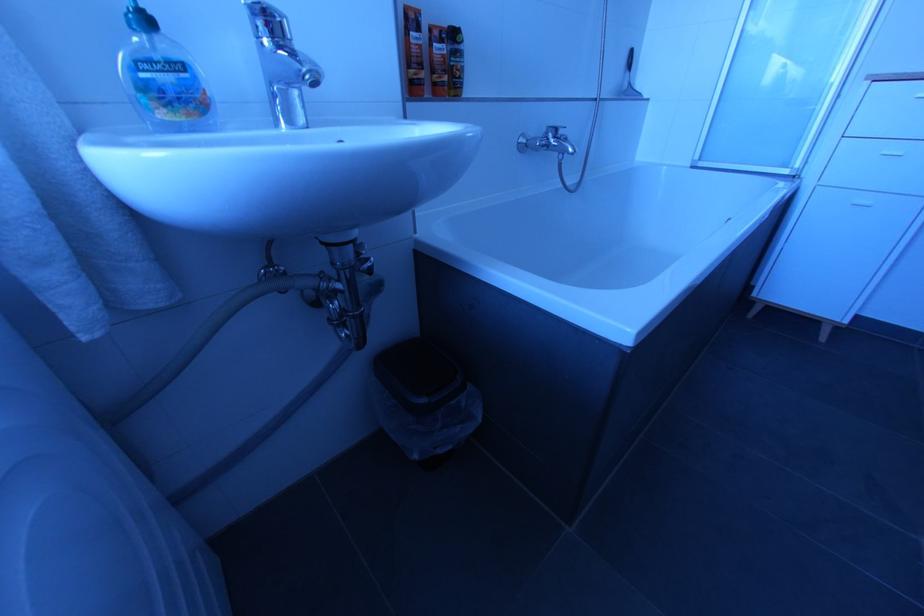
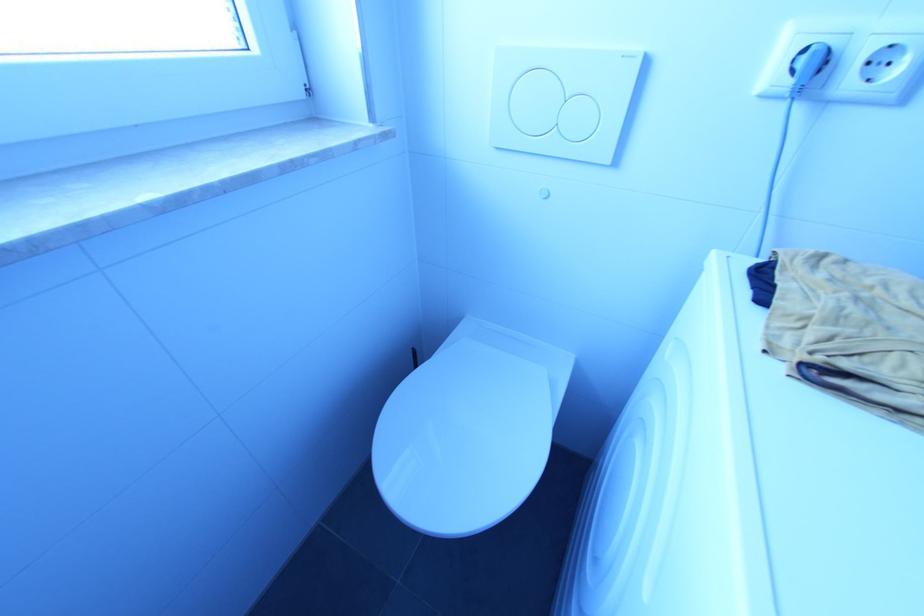
The first image is from the beginning of the video and the second image is from the end. How did the camera likely rotate when shooting the video?

The camera rotated toward left-down.